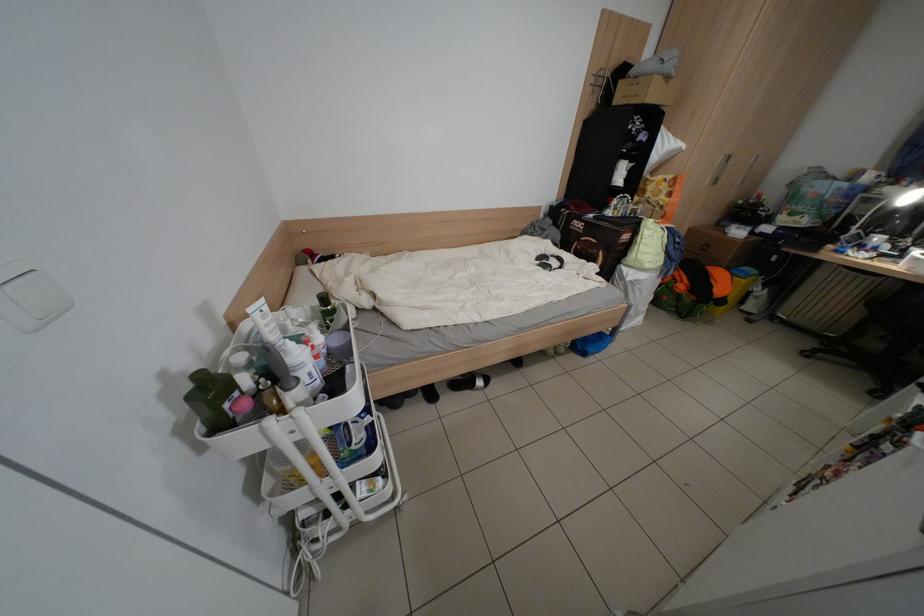
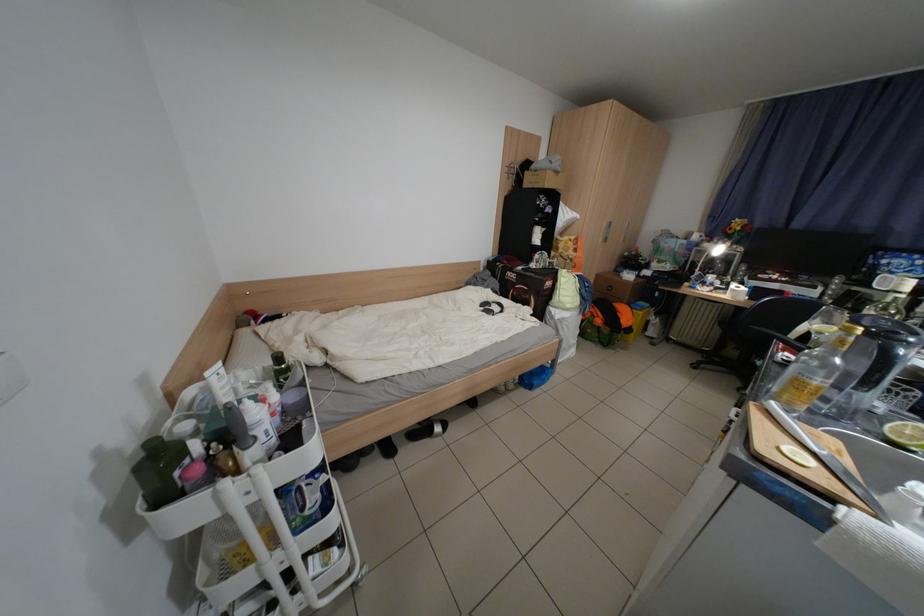
Find the pixel in the second image that matches (268,317) in the first image.

(225, 379)